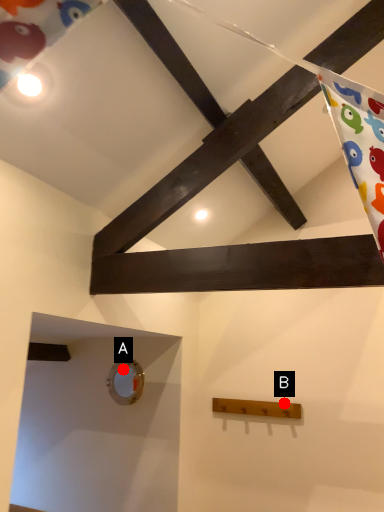
Question: Two points are circled on the image, labeled by A and B beside each circle. Which point appears farthest from the camera in this image?

Choices:
 (A) A is further
 (B) B is further

Answer: (A)